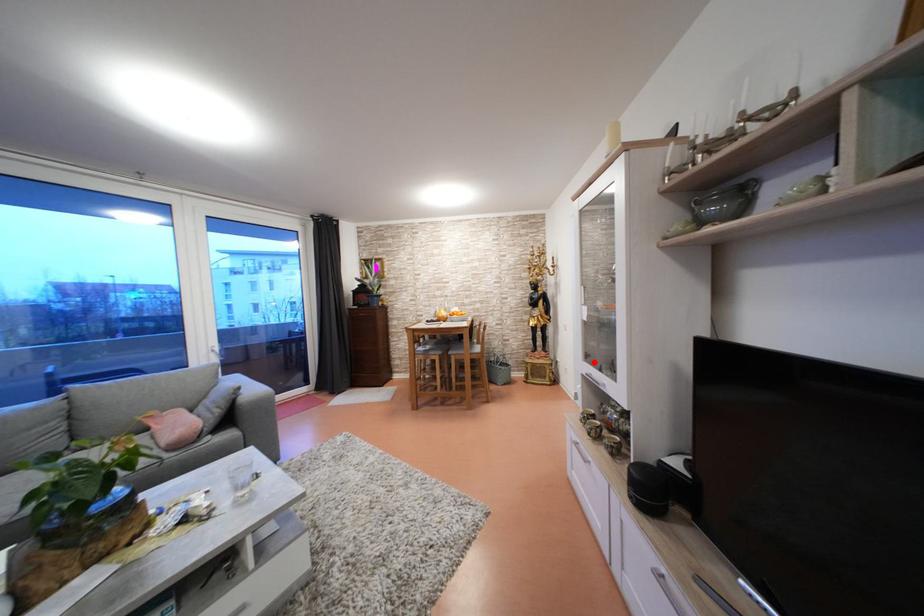
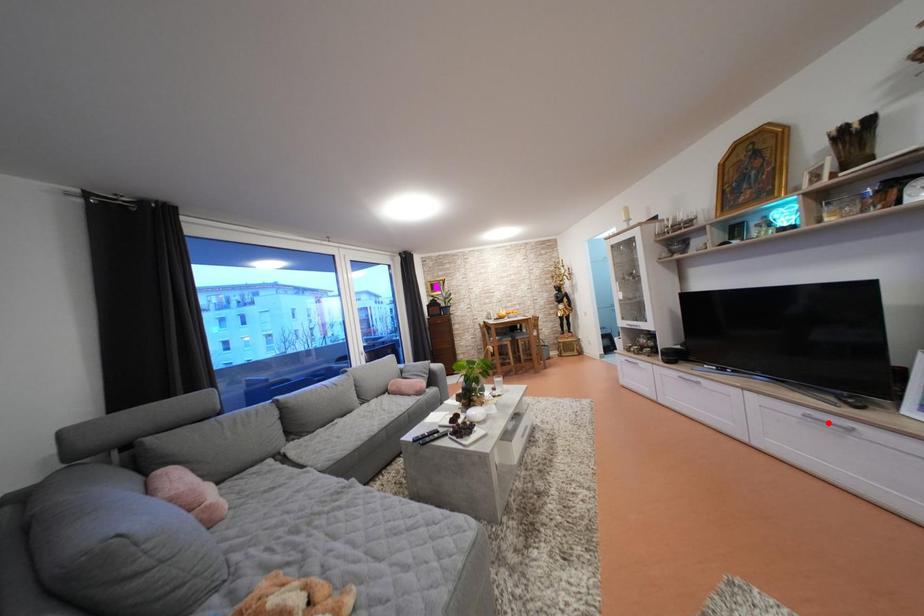
I am providing you with two images of the same scene from different viewpoints. A red point is marked on the first image and another point is marked on the second image. Does the point marked in image1 correspond to the same location as the one in image2?

No